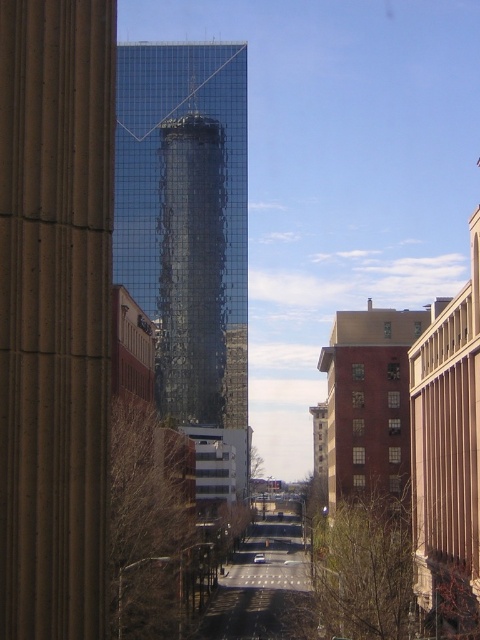
Question: Is brown stone pillar at left behind glossy glass skyscraper at center?

Choices:
 (A) no
 (B) yes

Answer: (A)

Question: Can you confirm if brown stone pillar at left is smaller than glossy glass skyscraper at center?

Choices:
 (A) no
 (B) yes

Answer: (B)

Question: Can you confirm if brown stone pillar at left is thinner than glossy glass skyscraper at center?

Choices:
 (A) no
 (B) yes

Answer: (B)